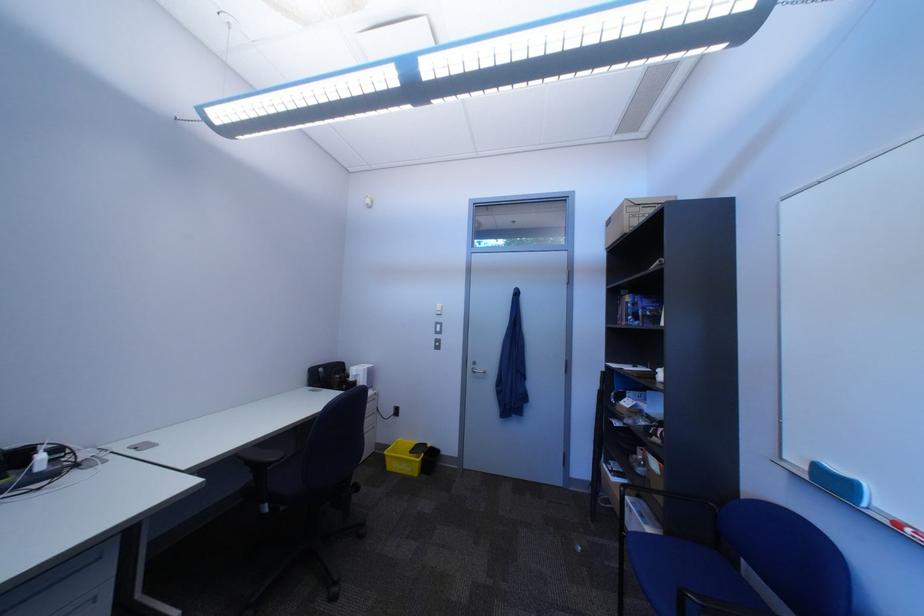
Where would you pull the silver door handle? Please return your answer as a coordinate pair (x, y).

(476, 368)